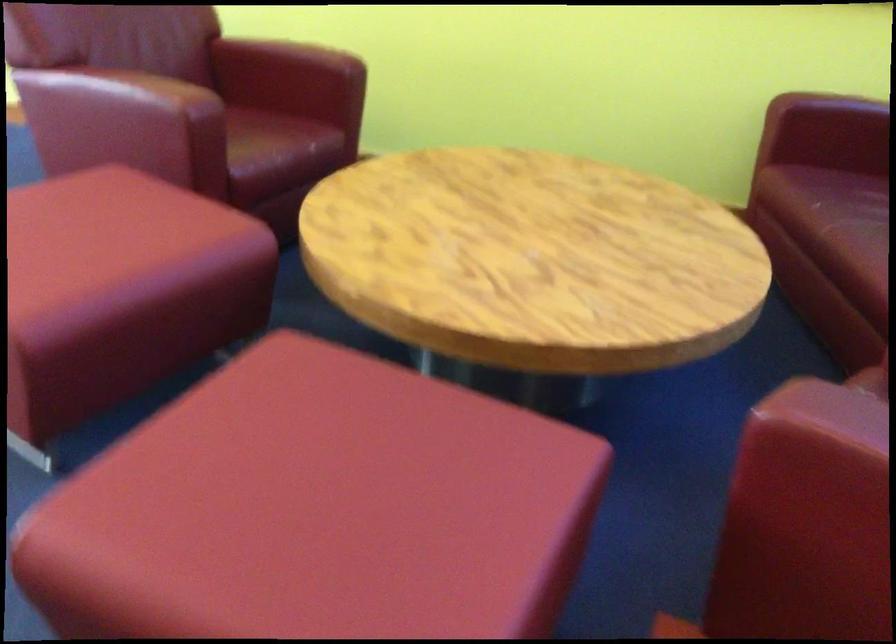
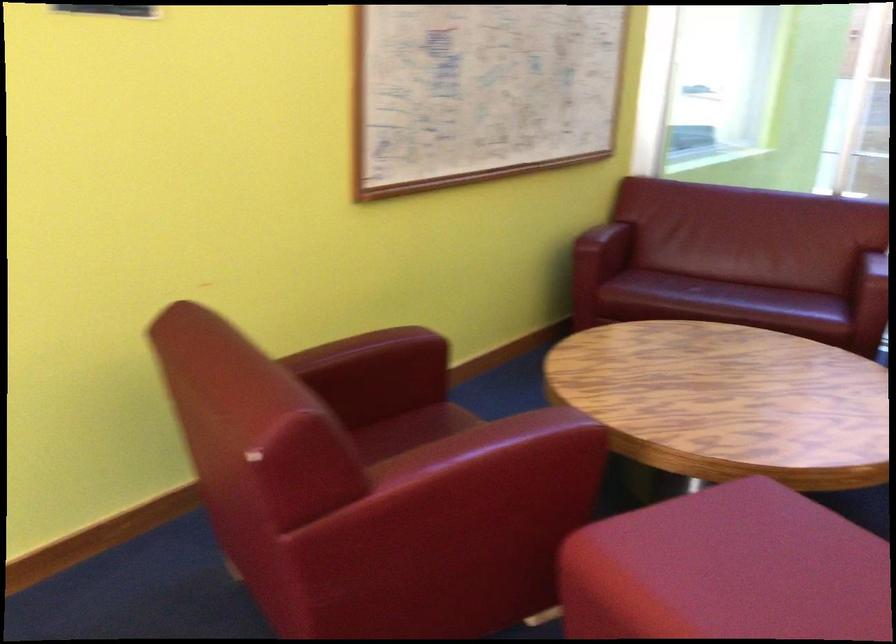
The point at [76,198] is marked in the first image. Where is the corresponding point in the second image?

(727, 570)